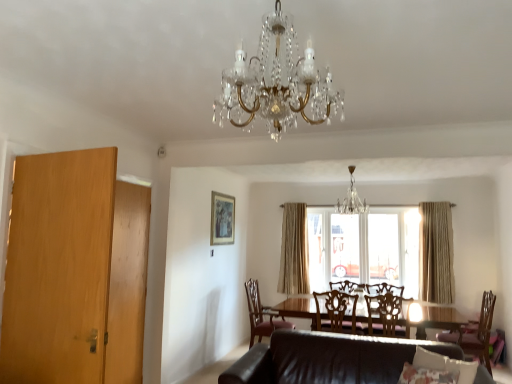
Question: Could you tell me if wooden chair at center, which appears as the second chair when viewed from the right, is turned towards wooden door at left?

Choices:
 (A) yes
 (B) no

Answer: (B)

Question: Considering the relative sizes of wooden chair at center, which appears as the second chair when viewed from the right, and wooden door at left in the image provided, is wooden chair at center, which appears as the second chair when viewed from the right, bigger than wooden door at left?

Choices:
 (A) yes
 (B) no

Answer: (B)

Question: From a real-world perspective, is wooden chair at center, marked as the third chair in a left-to-right arrangement, over wooden door at left?

Choices:
 (A) no
 (B) yes

Answer: (A)

Question: Can we say wooden chair at center, marked as the third chair in a left-to-right arrangement, lies outside wooden door at left?

Choices:
 (A) no
 (B) yes

Answer: (B)

Question: Is wooden chair at center, marked as the third chair in a left-to-right arrangement, next to wooden door at left?

Choices:
 (A) yes
 (B) no

Answer: (B)

Question: From their relative heights in the image, would you say leather couch at lower center is taller or shorter than wooden chair at center, which is counted as the second chair, starting from the left?

Choices:
 (A) tall
 (B) short

Answer: (B)

Question: Is point (266, 364) positioned closer to the camera than point (354, 299)?

Choices:
 (A) farther
 (B) closer

Answer: (B)

Question: Do you think leather couch at lower center is within wooden chair at center, which is counted as the second chair, starting from the left, or outside of it?

Choices:
 (A) inside
 (B) outside

Answer: (B)

Question: Is leather couch at lower center bigger or smaller than wooden chair at center, which is counted as the third chair, starting from the right?

Choices:
 (A) big
 (B) small

Answer: (A)

Question: Considering the positions of point (336, 203) and point (287, 281), is point (336, 203) closer or farther from the camera than point (287, 281)?

Choices:
 (A) farther
 (B) closer

Answer: (B)

Question: Relative to beige fabric curtain at center, which is the second curtain in front-to-back order, is crystal glass chandelier at center, positioned as the first chandelier in right-to-left order, in front or behind?

Choices:
 (A) behind
 (B) front

Answer: (B)

Question: Is crystal glass chandelier at center, the 2th chandelier from the left, to the left or to the right of beige fabric curtain at center, the first curtain viewed from the left, in the image?

Choices:
 (A) right
 (B) left

Answer: (A)

Question: Would you say crystal glass chandelier at center, positioned as the first chandelier in right-to-left order, is inside or outside beige fabric curtain at center, which is the second curtain in front-to-back order?

Choices:
 (A) outside
 (B) inside

Answer: (A)

Question: From their relative heights in the image, would you say fluffy fabric pillow at lower center is taller or shorter than beige fabric curtain at center, acting as the second curtain starting from the right?

Choices:
 (A) short
 (B) tall

Answer: (A)

Question: From a real-world perspective, relative to beige fabric curtain at center, the first curtain viewed from the left, is fluffy fabric pillow at lower center vertically above or below?

Choices:
 (A) below
 (B) above

Answer: (A)